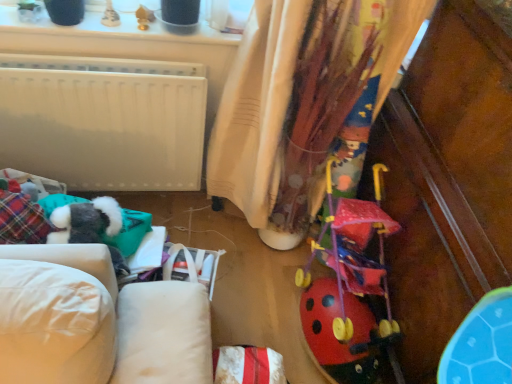
Question: Is textured beige curtain at center bigger or smaller than rubberized red stroller at center-right?

Choices:
 (A) small
 (B) big

Answer: (B)

Question: Is textured beige curtain at center situated inside rubberized red stroller at center-right or outside?

Choices:
 (A) inside
 (B) outside

Answer: (B)

Question: Looking at their shapes, would you say textured beige curtain at center is wider or thinner than rubberized red stroller at center-right?

Choices:
 (A) thin
 (B) wide

Answer: (A)

Question: Is rubberized red stroller at center-right in front of or behind textured beige curtain at center in the image?

Choices:
 (A) front
 (B) behind

Answer: (B)

Question: Based on their sizes in the image, would you say rubberized red stroller at center-right is bigger or smaller than textured beige curtain at center?

Choices:
 (A) big
 (B) small

Answer: (B)

Question: From the image's perspective, is rubberized red stroller at center-right located above or below textured beige curtain at center?

Choices:
 (A) below
 (B) above

Answer: (A)

Question: Would you say rubberized red stroller at center-right is inside or outside textured beige curtain at center?

Choices:
 (A) inside
 (B) outside

Answer: (B)